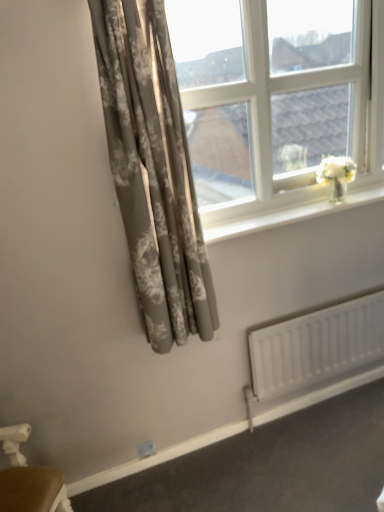
Question: Considering the relative sizes of matte gray floral curtain at left and clear glass window at upper right in the image provided, is matte gray floral curtain at left wider than clear glass window at upper right?

Choices:
 (A) yes
 (B) no

Answer: (A)

Question: Does matte gray floral curtain at left turn towards clear glass window at upper right?

Choices:
 (A) yes
 (B) no

Answer: (B)

Question: Is matte gray floral curtain at left not close to clear glass window at upper right?

Choices:
 (A) no
 (B) yes

Answer: (A)

Question: Is matte gray floral curtain at left to the left of clear glass window at upper right from the viewer's perspective?

Choices:
 (A) yes
 (B) no

Answer: (A)

Question: Can clear glass window at upper right be found inside matte gray floral curtain at left?

Choices:
 (A) no
 (B) yes

Answer: (A)

Question: Does matte gray floral curtain at left have a smaller size compared to clear glass window at upper right?

Choices:
 (A) yes
 (B) no

Answer: (A)

Question: Is the depth of white matte radiator at lower right greater than that of matte gray floral curtain at left?

Choices:
 (A) no
 (B) yes

Answer: (B)

Question: From the image's perspective, is white matte radiator at lower right over matte gray floral curtain at left?

Choices:
 (A) no
 (B) yes

Answer: (A)

Question: Is white matte radiator at lower right oriented towards matte gray floral curtain at left?

Choices:
 (A) no
 (B) yes

Answer: (A)

Question: From a real-world perspective, is white matte radiator at lower right located beneath matte gray floral curtain at left?

Choices:
 (A) yes
 (B) no

Answer: (A)

Question: Is white matte radiator at lower right to the left of matte gray floral curtain at left from the viewer's perspective?

Choices:
 (A) yes
 (B) no

Answer: (B)

Question: Considering the relative sizes of white matte radiator at lower right and matte gray floral curtain at left in the image provided, is white matte radiator at lower right taller than matte gray floral curtain at left?

Choices:
 (A) yes
 (B) no

Answer: (B)

Question: Considering the relative sizes of matte gray floral curtain at left and white glossy window sill at upper center in the image provided, is matte gray floral curtain at left wider than white glossy window sill at upper center?

Choices:
 (A) no
 (B) yes

Answer: (B)